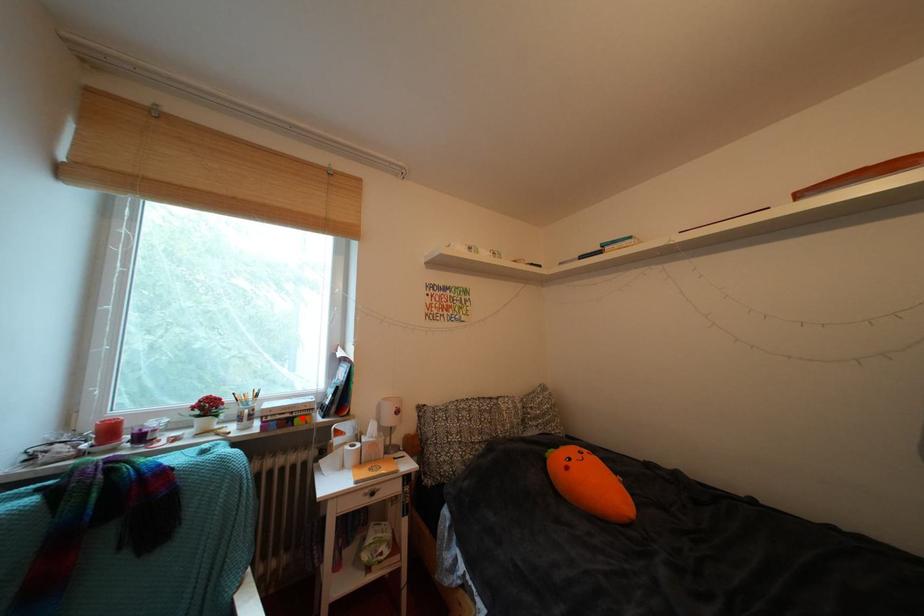
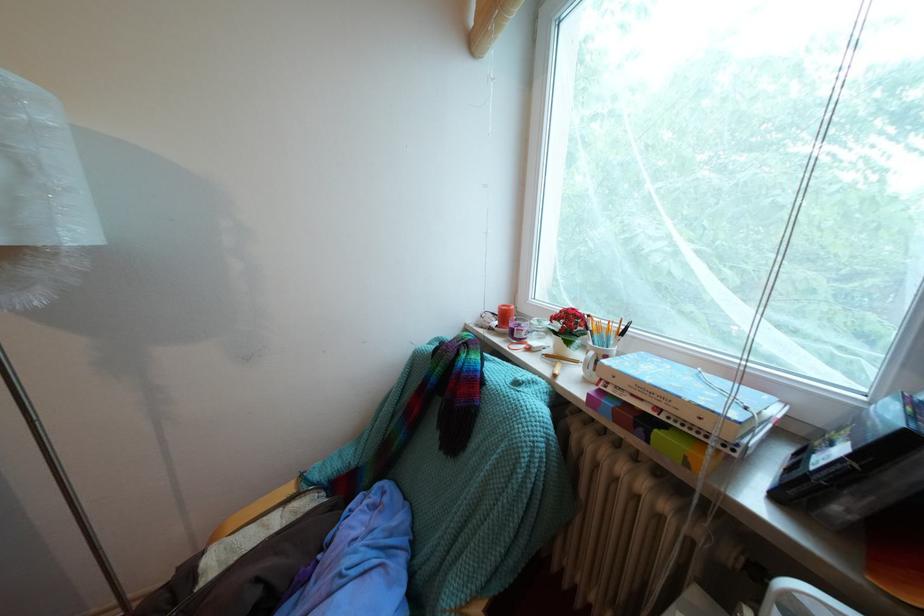
The point at the highlighted location is marked in the first image. Where is the corresponding point in the second image?

(669, 415)